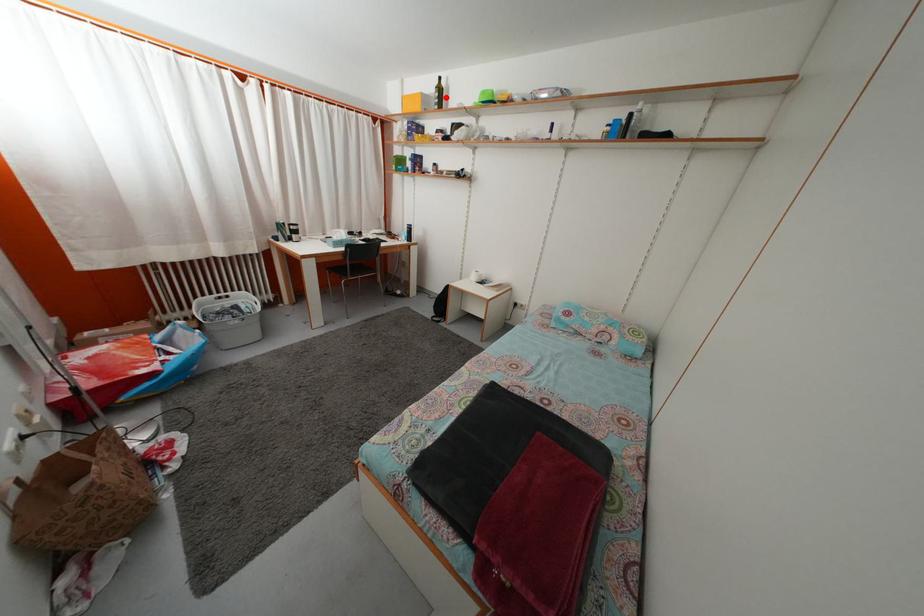
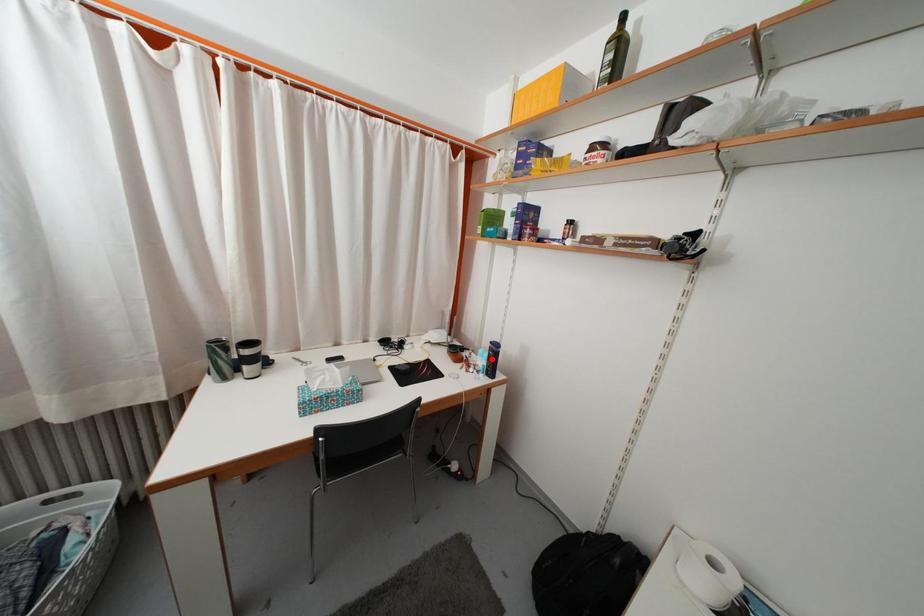
I am providing you with two images of the same scene from different viewpoints. A red point is marked on the first image and another point is marked on the second image. Is the red point in image1 aligned with the point shown in image2?

No